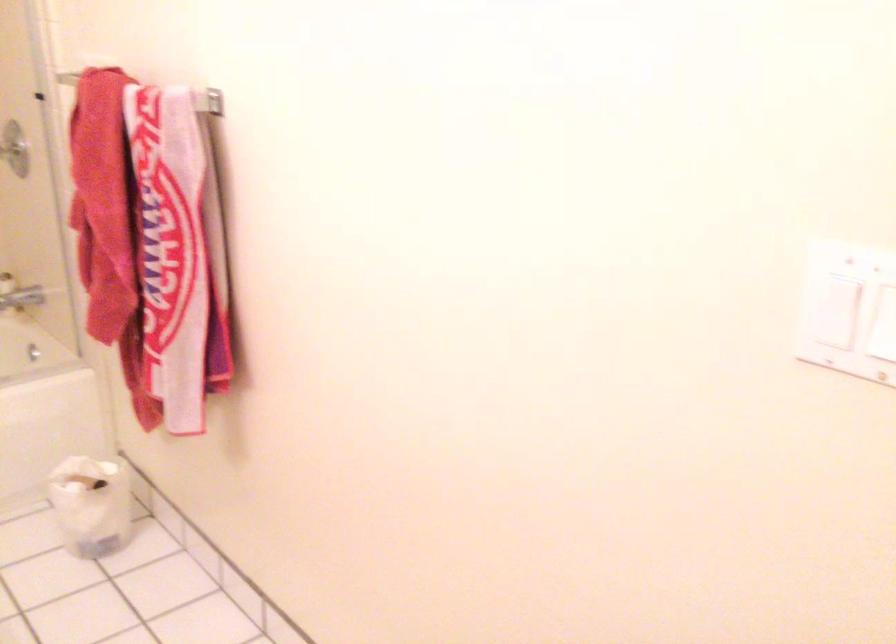
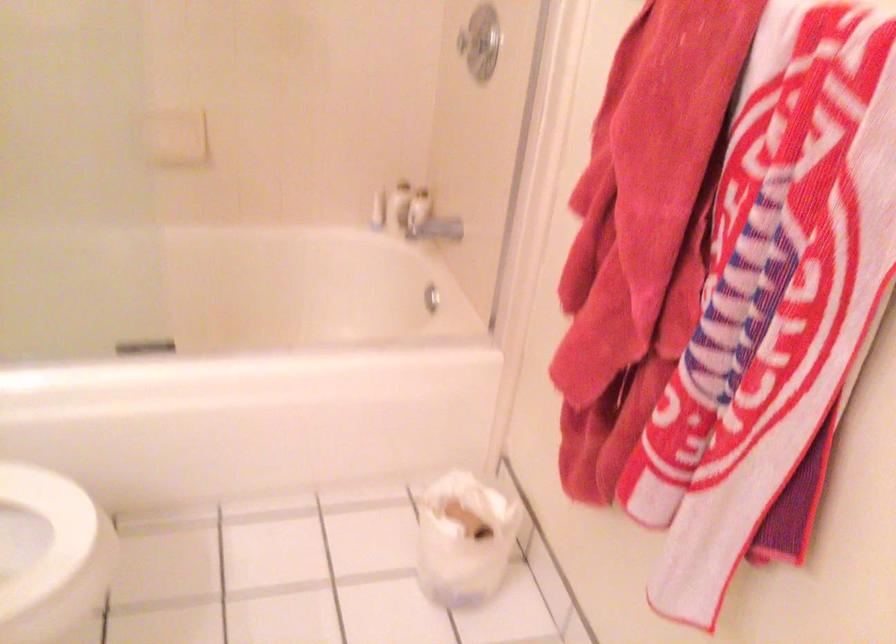
Find the pixel in the second image that matches pixel 90 489 in the first image.

(464, 538)